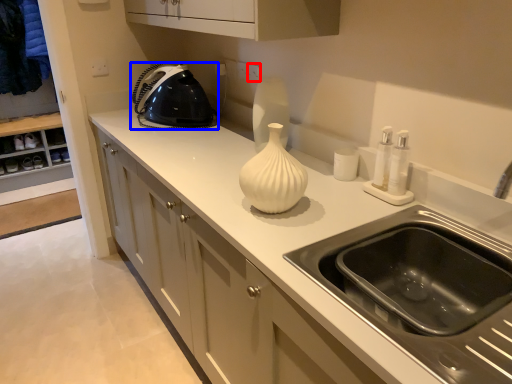
Question: Which object appears farthest to the camera in this image, electric outlet (highlighted by a red box) or home appliance (highlighted by a blue box)?

Choices:
 (A) electric outlet
 (B) home appliance

Answer: (A)